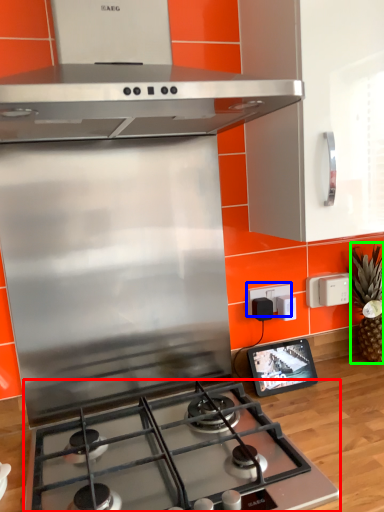
Question: Based on their relative distances, which object is nearer to gas stove (highlighted by a red box)? Choose from electric outlet (highlighted by a blue box) and pineapple (highlighted by a green box).

Choices:
 (A) electric outlet
 (B) pineapple

Answer: (A)